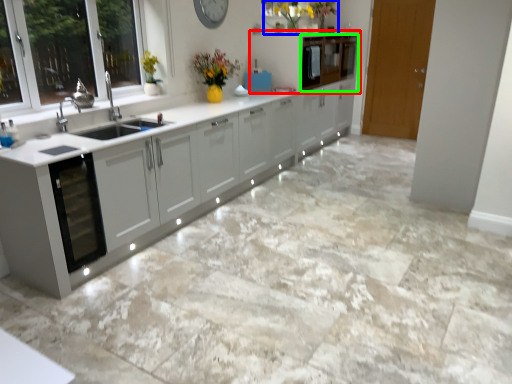
Question: Considering the real-world distances, which object is closest to cabinetry (highlighted by a red box)? floral arrangement (highlighted by a blue box) or cabinetry (highlighted by a green box).

Choices:
 (A) floral arrangement
 (B) cabinetry

Answer: (B)